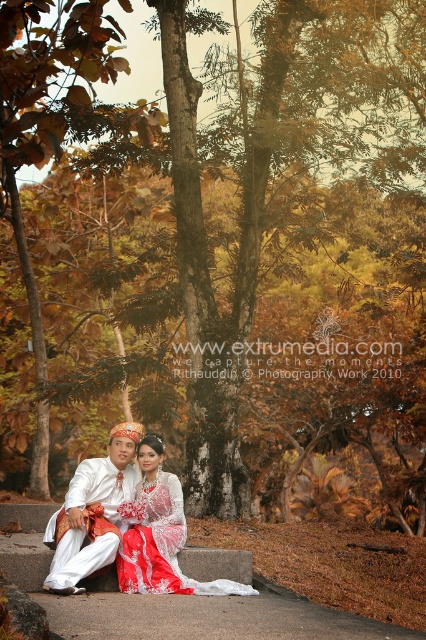
Is white satin suit at center wider than white lace dress at center?

In fact, white satin suit at center might be narrower than white lace dress at center.

Which is more to the left, white satin suit at center or white lace dress at center?

From the viewer's perspective, white satin suit at center appears more on the left side.

The height and width of the screenshot is (640, 426). What do you see at coordinates (92, 513) in the screenshot?
I see `white satin suit at center` at bounding box center [92, 513].

At what (x,y) coordinates should I click in order to perform the action: click on white satin suit at center. Please return your answer as a coordinate pair (x, y). The width and height of the screenshot is (426, 640). Looking at the image, I should click on 92,513.